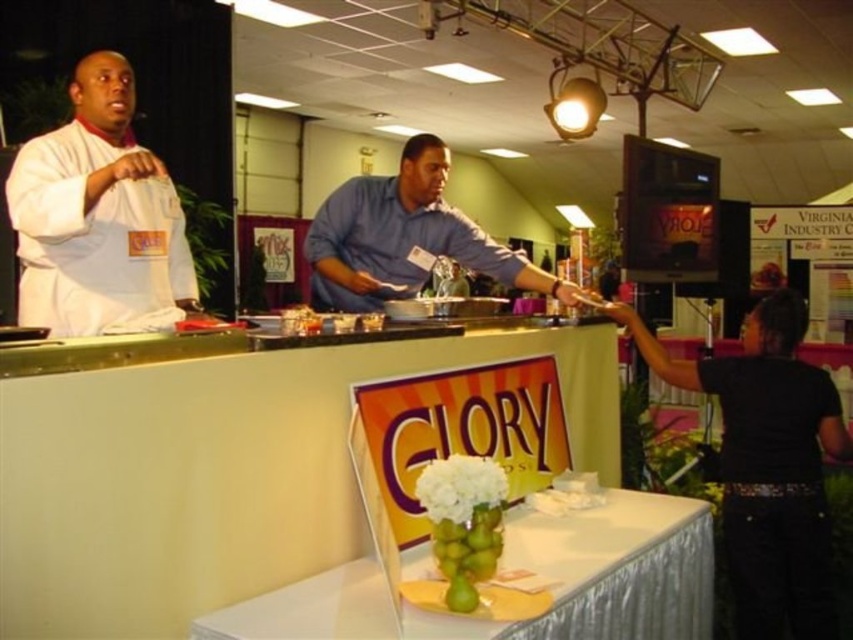
You are a guest at the event and want to take a photo of the sign. To do so, you need to ensure the green glass vase at center and the blue cotton shirt at center are not blocking the sign. Based on their heights, which object is more likely to block the view of the sign?

The blue cotton shirt at center is taller than the green glass vase at center, so it is more likely to block the view of the sign.

You are a guest at this event and need to pass between the white chef coat at left and the blue cotton shirt at center to get to the exit. The width of your wheelchair is 28 inches. Can you safely navigate through the space between them?

The distance between the white chef coat at left and the blue cotton shirt at center is 34.32 inches. Since your wheelchair is 28 inches wide, there is enough space to safely pass through the gap between them.